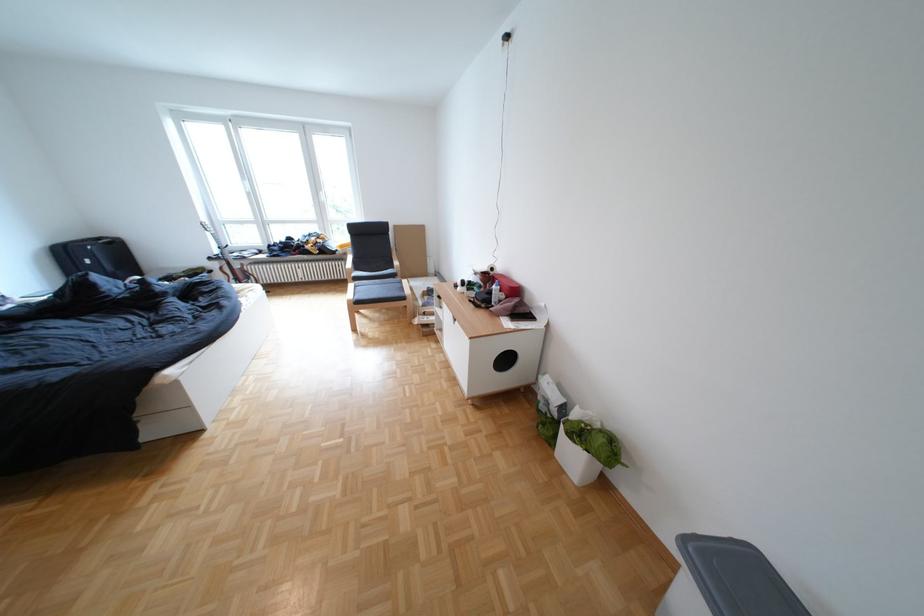
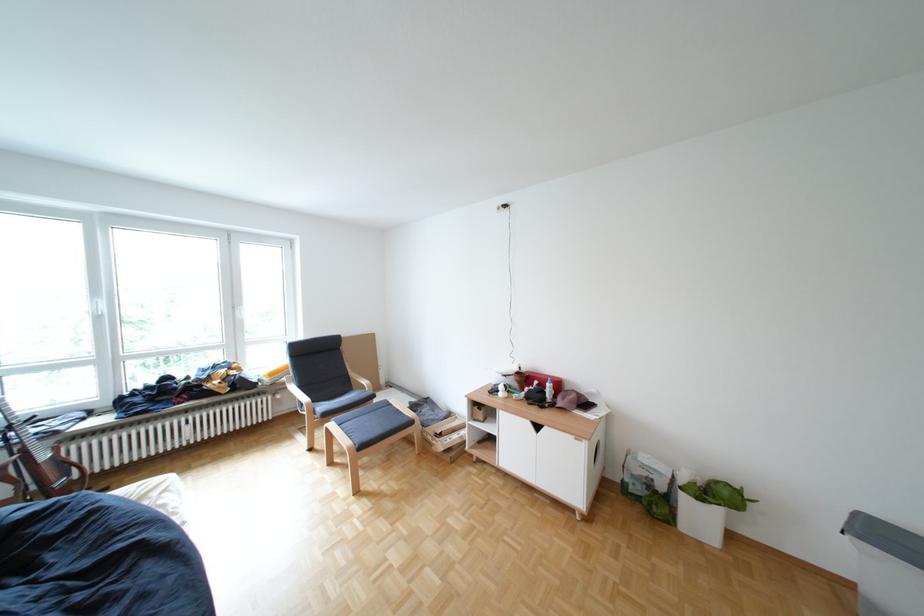
The point at (440, 314) is marked in the first image. Where is the corresponding point in the second image?

(456, 436)